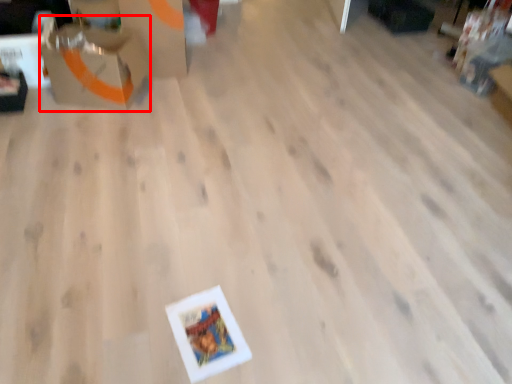
Question: From the image's perspective, where is cardboard box (annotated by the red box) located in relation to cardboard box in the image?

Choices:
 (A) below
 (B) above

Answer: (A)